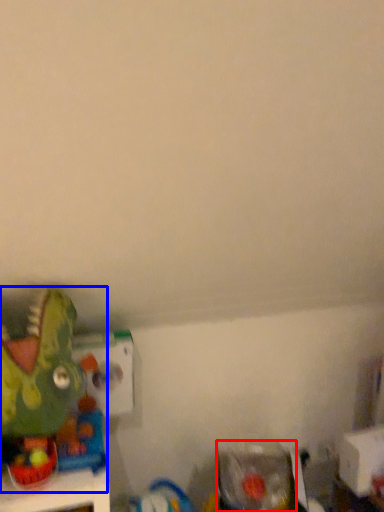
Question: Which point is closer to the camera, toy (highlighted by a red box) or toy (highlighted by a blue box)?

Choices:
 (A) toy
 (B) toy

Answer: (B)